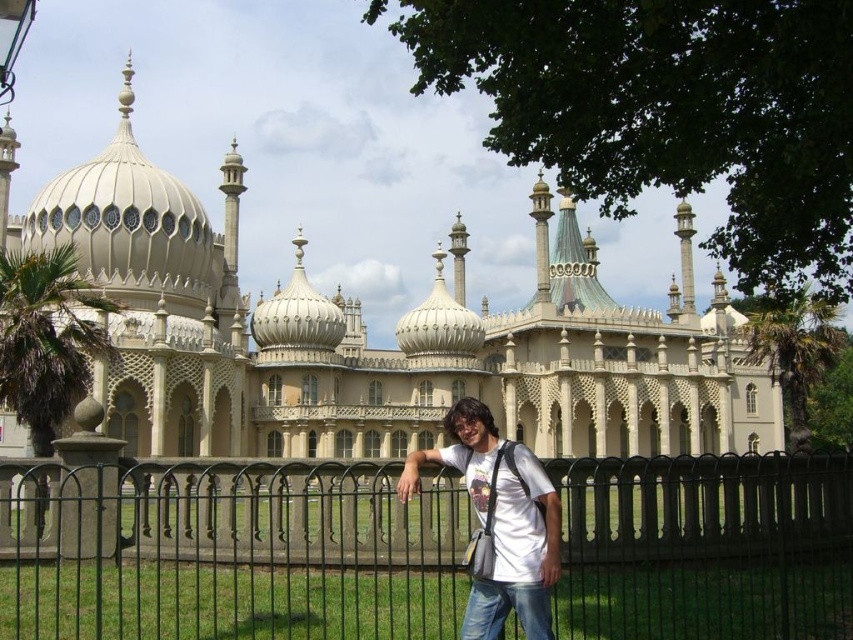
Can you confirm if black metal fence at center is smaller than white matte t-shirt at center?

Incorrect, black metal fence at center is not smaller in size than white matte t-shirt at center.

Does black metal fence at center appear over white matte t-shirt at center?

No, black metal fence at center is not above white matte t-shirt at center.

Is point (605, 490) positioned before point (479, 460)?

No, it is behind (479, 460).

At what (x,y) coordinates should I click in order to perform the action: click on black metal fence at center. Please return your answer as a coordinate pair (x, y). Image resolution: width=853 pixels, height=640 pixels. Looking at the image, I should click on (229, 552).

Which of these two, white stone palace at center or white matte t-shirt at center, stands shorter?

With less height is white matte t-shirt at center.

Image resolution: width=853 pixels, height=640 pixels. Describe the element at coordinates (379, 348) in the screenshot. I see `white stone palace at center` at that location.

Identify the location of white stone palace at center. The image size is (853, 640). (379, 348).

Does point (223, 464) lie in front of point (735, 410)?

Yes, it is in front of point (735, 410).

Between black metal fence at center and white stone palace at center, which one has more height?

With more height is white stone palace at center.

Does point (704, 474) lie behind point (735, 449)?

No, it is not.

Locate an element on the screen. black metal fence at center is located at coordinates (229, 552).